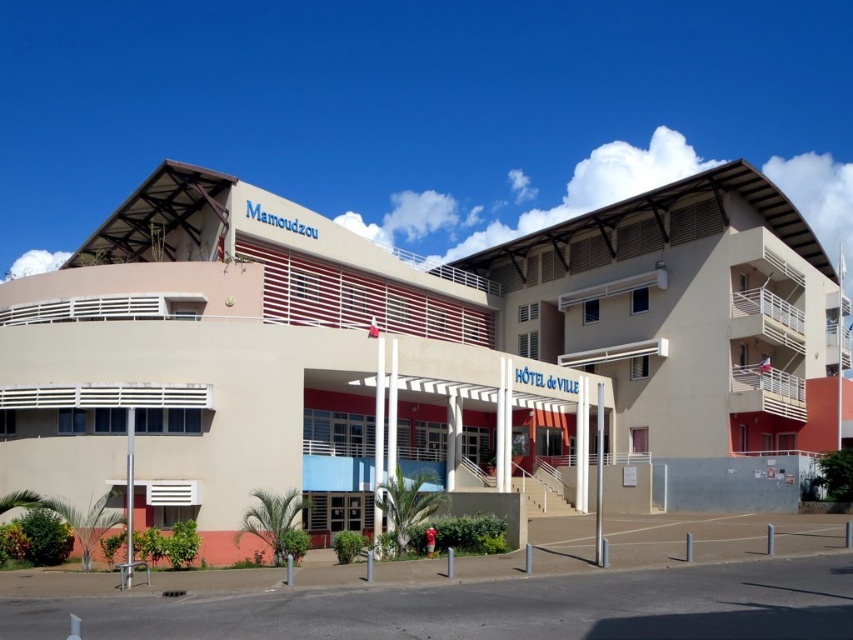
Does point (407, 472) lie in front of point (730, 262)?

Yes, point (407, 472) is closer to viewer.

Is point (177, 310) closer to viewer compared to point (718, 381)?

Yes, it is in front of point (718, 381).

At what (x,y) coordinates should I click in order to perform the action: click on beige concrete building at center. Please return your answer as a coordinate pair (x, y). The width and height of the screenshot is (853, 640). Looking at the image, I should click on (263, 368).